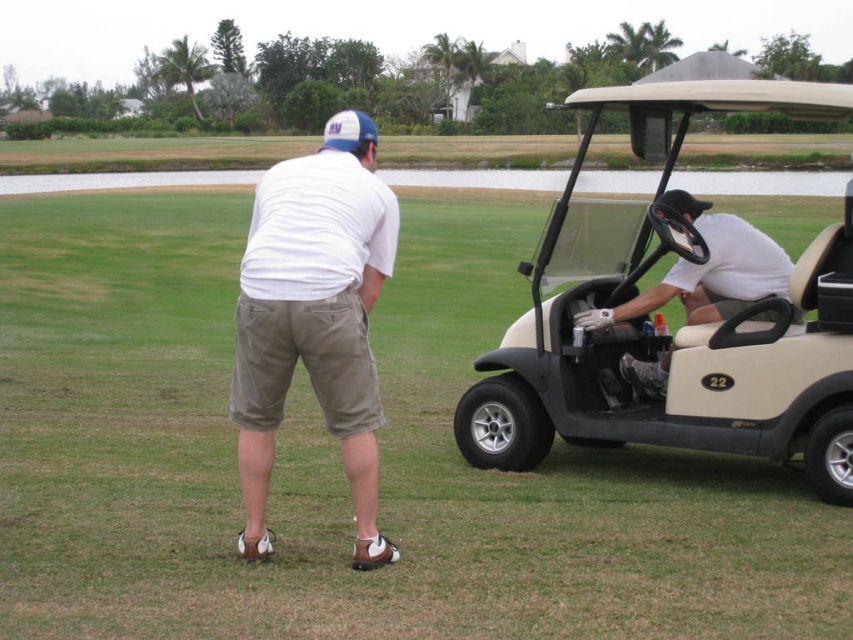
Question: Which point is closer to the camera?

Choices:
 (A) (340, 122)
 (B) (695, 198)
 (C) (535, 388)
 (D) (718, 276)

Answer: (A)

Question: Which point is farther from the camera taking this photo?

Choices:
 (A) (786, 256)
 (B) (809, 468)
 (C) (276, 349)

Answer: (A)

Question: Where is beige matte golf cart at right located in relation to black matte baseball hat at right in the image?

Choices:
 (A) above
 (B) below

Answer: (A)

Question: Which object is positioned farthest from the beige matte golf cart at right?

Choices:
 (A) green grass at center
 (B) white matte golf cart at center
 (C) white cotton shirt at center

Answer: (C)

Question: Is white matte golf cart at center wider than black matte baseball hat at right?

Choices:
 (A) no
 (B) yes

Answer: (B)

Question: Can you confirm if beige matte golf cart at right is wider than white matte golf cart at center?

Choices:
 (A) no
 (B) yes

Answer: (B)